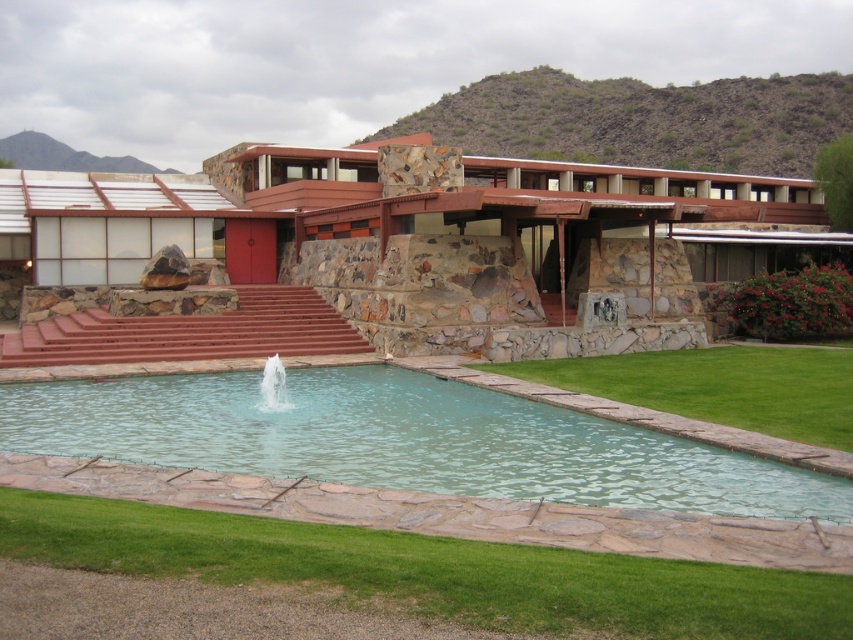
You are standing at the base of the red stairs leading up to the building. You want to walk to the fountain in the pool. Which direction should you go relative to the green grass at lower center and green grass at lower right?

Since the green grass at lower center is below the green grass at lower right, you should move towards the green grass at lower center to reach the fountain, as it is closer to the pool area.

You are a landscape architect designing a new garden. You need to place a small statue that requires a flat, stable surface. Which area between the green grass at lower center and the clear glass water at center would be more suitable for placing the statue?

The green grass at lower center has a larger size compared to the clear glass water at center, making it a more suitable area for placing the statue as it provides a stable and flat surface.